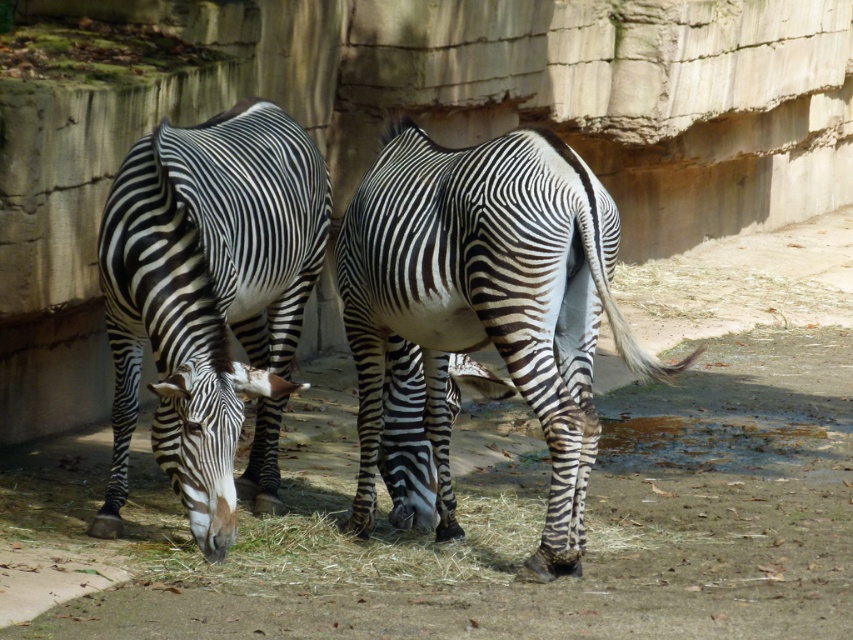
Question: Does black and white striped zebra at center appear over black and white striped zebra at left?

Choices:
 (A) no
 (B) yes

Answer: (A)

Question: Is black and white striped zebra at center further to the viewer compared to black and white striped zebra at left?

Choices:
 (A) no
 (B) yes

Answer: (A)

Question: Which point appears closest to the camera in this image?

Choices:
 (A) (398, 145)
 (B) (256, 250)

Answer: (B)

Question: Is black and white striped zebra at center to the left of black and white striped zebra at left from the viewer's perspective?

Choices:
 (A) yes
 (B) no

Answer: (B)

Question: Which of the following is the closest to the observer?

Choices:
 (A) black and white striped zebra at left
 (B) black and white striped zebra at center

Answer: (B)